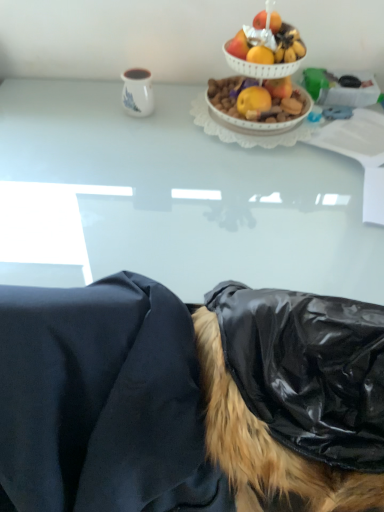
Identify the location of free space above white glossy table at upper center (from a real-world perspective). Image resolution: width=384 pixels, height=512 pixels. (205, 167).